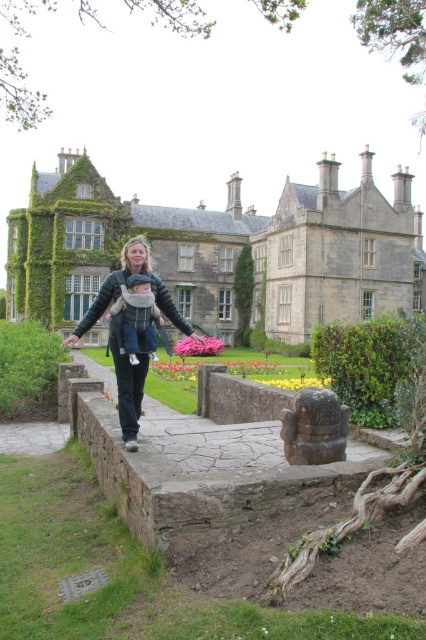
Question: Which of the following is the closest to the observer?

Choices:
 (A) click(143, 308)
 (B) click(118, 340)
 (C) click(164, 445)
 (D) click(51, 444)

Answer: (B)

Question: Considering the relative positions of stone at center and gray stone path at lower left in the image provided, where is stone at center located with respect to gray stone path at lower left?

Choices:
 (A) below
 (B) above

Answer: (B)

Question: Which point is farther from the camera taking this photo?

Choices:
 (A) (245, 492)
 (B) (155, 346)

Answer: (B)

Question: Does denim jacket at center appear over gray stone path at lower left?

Choices:
 (A) no
 (B) yes

Answer: (B)

Question: Based on their relative distances, which object is farther from the denim jacket at center?

Choices:
 (A) gray stone path at lower left
 (B) stone at center

Answer: (A)

Question: Is matte gray baby carrier at center in front of gray stone path at lower left?

Choices:
 (A) yes
 (B) no

Answer: (A)